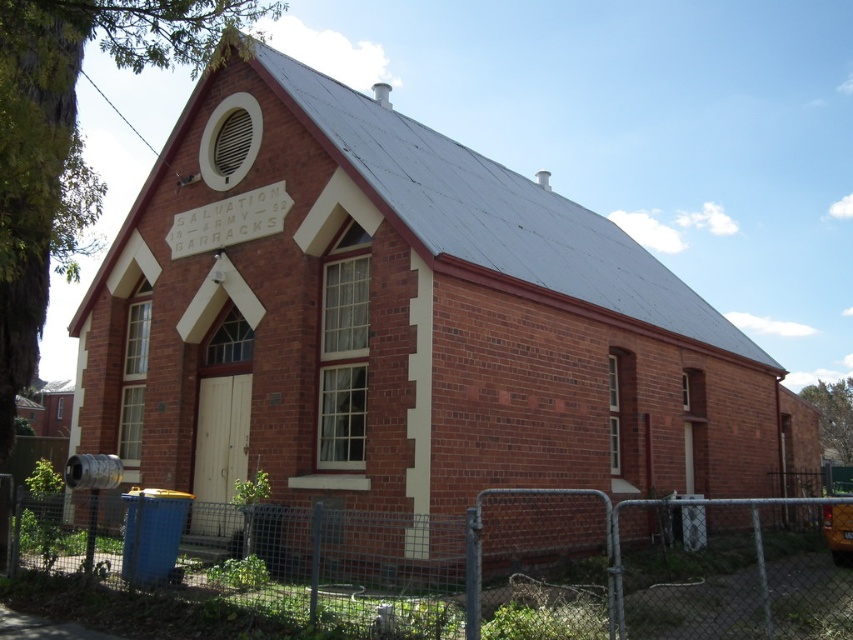
Question: Which point is farther to the camera?

Choices:
 (A) (838, 531)
 (B) (412, 620)

Answer: (A)

Question: Which point is farther to the camera?

Choices:
 (A) yellow matte school bus at lower right
 (B) metal chain-link fence at lower center

Answer: (A)

Question: Is the position of metal chain-link fence at lower center more distant than that of yellow matte school bus at lower right?

Choices:
 (A) no
 (B) yes

Answer: (A)

Question: Which object appears closest to the camera in this image?

Choices:
 (A) yellow matte school bus at lower right
 (B) metal chain-link fence at lower center

Answer: (B)

Question: Can you confirm if metal chain-link fence at lower center is wider than yellow matte school bus at lower right?

Choices:
 (A) yes
 (B) no

Answer: (A)

Question: Can you confirm if metal chain-link fence at lower center is positioned to the right of yellow matte school bus at lower right?

Choices:
 (A) no
 (B) yes

Answer: (A)